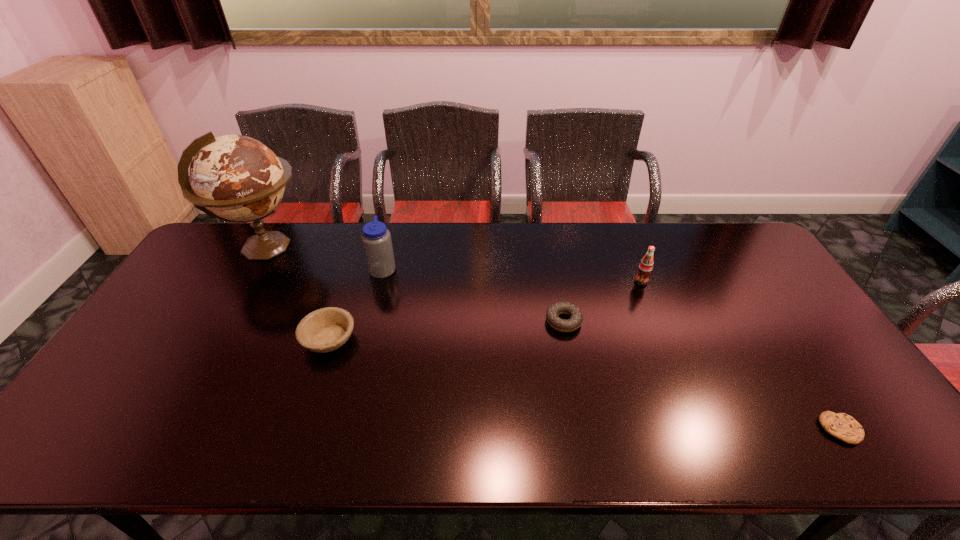
In order to click on empty location between the water bottle and the bowl in this screenshot , I will do `click(356, 303)`.

Locate an element on the screen. The image size is (960, 540). vacant area that lies between the globe and the cookie is located at coordinates (553, 339).

The height and width of the screenshot is (540, 960). I want to click on free space between the second tallest object and the globe, so click(324, 258).

Locate an element on the screen. free spot between the fifth shortest object and the tallest object is located at coordinates (324, 258).

Image resolution: width=960 pixels, height=540 pixels. I want to click on empty space between the globe and the third tallest object, so click(x=454, y=265).

You are a GUI agent. You are given a task and a screenshot of the screen. Output one action in this format:
    pyautogui.click(x=<x>, y=<y>)
    Task: Click on the empty space between the fifth object from left to right and the doughnut
    
    Given the screenshot: What is the action you would take?
    pyautogui.click(x=602, y=301)

Locate an element on the screen. This screenshot has height=540, width=960. vacant area between the cookie and the tallest object is located at coordinates (553, 339).

Find the location of a particular element. Image resolution: width=960 pixels, height=540 pixels. vacant space that's between the tallest object and the fourth shortest object is located at coordinates (454, 265).

Locate which object is the second closest to the shortest object. Please provide its 2D coordinates. Your answer should be formatted as a tuple, i.e. [(x, y)], where the tuple contains the x and y coordinates of a point satisfying the conditions above.

[(576, 317)]

Point out which object is positioned as the fourth nearest to the cookie. Please provide its 2D coordinates. Your answer should be formatted as a tuple, i.e. [(x, y)], where the tuple contains the x and y coordinates of a point satisfying the conditions above.

[(376, 239)]